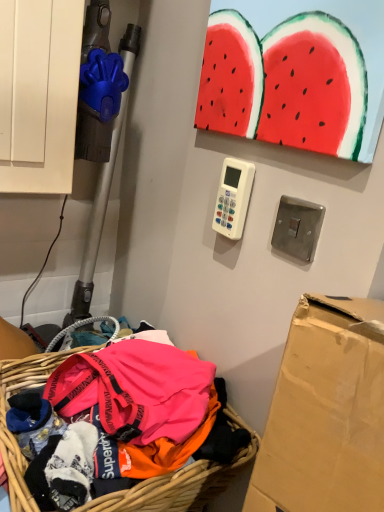
What do you see at coordinates (297, 228) in the screenshot? The width and height of the screenshot is (384, 512). I see `brushed metal light switch at upper right` at bounding box center [297, 228].

Where is `bright pink fabric at lower left`? This screenshot has width=384, height=512. bright pink fabric at lower left is located at coordinates (179, 486).

The height and width of the screenshot is (512, 384). I want to click on white plastic remote control at center, so click(233, 198).

In order to click on brushed metal light switch at upper right in this screenshot , I will do `click(297, 228)`.

Image resolution: width=384 pixels, height=512 pixels. I want to click on scale above the bright pink fabric at lower left (from the image's perspective), so click(x=233, y=198).

Relative to bright pink fabric at lower left, is white plastic remote control at center in front or behind?

white plastic remote control at center is positioned farther from the viewer than bright pink fabric at lower left.

From the image's perspective, relative to bright pink fabric at lower left, is white plastic remote control at center above or below?

white plastic remote control at center is above bright pink fabric at lower left.

Is bright pink fabric at lower left located within white plastic remote control at center?

No.

Does white plastic remote control at center have a greater width compared to brushed metal light switch at upper right?

Indeed, white plastic remote control at center has a greater width compared to brushed metal light switch at upper right.

Can you confirm if white plastic remote control at center is smaller than brushed metal light switch at upper right?

Incorrect, white plastic remote control at center is not smaller in size than brushed metal light switch at upper right.

From a real-world perspective, between white plastic remote control at center and brushed metal light switch at upper right, who is vertically lower?

brushed metal light switch at upper right.

Looking at the image, does brushed metal light switch at upper right seem bigger or smaller compared to white plastic remote control at center?

In the image, brushed metal light switch at upper right appears to be smaller than white plastic remote control at center.

Considering the relative positions of brushed metal light switch at upper right and white plastic remote control at center in the image provided, is brushed metal light switch at upper right to the right of white plastic remote control at center from the viewer's perspective?

Indeed, brushed metal light switch at upper right is positioned on the right side of white plastic remote control at center.

Looking at this image, in the image, is brushed metal light switch at upper right positioned in front of or behind white plastic remote control at center?

Visually, brushed metal light switch at upper right is located in front of white plastic remote control at center.

From a real-world perspective, relative to white plastic remote control at center, is brushed metal light switch at upper right vertically above or below?

brushed metal light switch at upper right is below white plastic remote control at center.

Is bright pink fabric at lower left positioned beyond the bounds of brushed metal light switch at upper right?

Indeed, bright pink fabric at lower left is completely outside brushed metal light switch at upper right.

From a real-world perspective, is bright pink fabric at lower left below brushed metal light switch at upper right?

Yes, from a real-world perspective, bright pink fabric at lower left is beneath brushed metal light switch at upper right.

Locate an element on the screen. This screenshot has width=384, height=512. basket directly beneath the brushed metal light switch at upper right (from a real-world perspective) is located at coordinates (179, 486).

Is bright pink fabric at lower left aimed at brushed metal light switch at upper right?

No, bright pink fabric at lower left is not facing towards brushed metal light switch at upper right.

From a real-world perspective, is bright pink fabric at lower left physically below white plastic remote control at center?

Yes, from a real-world perspective, bright pink fabric at lower left is below white plastic remote control at center.

Locate an element on the screen. The height and width of the screenshot is (512, 384). scale that is above the bright pink fabric at lower left (from a real-world perspective) is located at coordinates (233, 198).

Is bright pink fabric at lower left positioned with its back to white plastic remote control at center?

bright pink fabric at lower left is not turned away from white plastic remote control at center.

Who is bigger, bright pink fabric at lower left or white plastic remote control at center?

bright pink fabric at lower left is bigger.

Considering the relative sizes of brushed metal light switch at upper right and bright pink fabric at lower left in the image provided, is brushed metal light switch at upper right bigger than bright pink fabric at lower left?

No, brushed metal light switch at upper right is not bigger than bright pink fabric at lower left.

Looking at this image, is brushed metal light switch at upper right facing away from bright pink fabric at lower left?

No, brushed metal light switch at upper right is not facing the opposite direction of bright pink fabric at lower left.

Visually, is brushed metal light switch at upper right positioned to the left or to the right of bright pink fabric at lower left?

Based on their positions, brushed metal light switch at upper right is located to the right of bright pink fabric at lower left.

From the image's perspective, which one is positioned higher, brushed metal light switch at upper right or bright pink fabric at lower left?

brushed metal light switch at upper right is shown above in the image.

Where is `basket below the white plastic remote control at center (from the image's perspective)`? basket below the white plastic remote control at center (from the image's perspective) is located at coordinates (179, 486).

The width and height of the screenshot is (384, 512). Find the location of `scale behind the brushed metal light switch at upper right`. scale behind the brushed metal light switch at upper right is located at coordinates (233, 198).

When comparing their distances from bright pink fabric at lower left, does brushed metal light switch at upper right or white plastic remote control at center seem closer?

white plastic remote control at center is closer to bright pink fabric at lower left.

Which object lies nearer to the anchor point white plastic remote control at center, bright pink fabric at lower left or brushed metal light switch at upper right?

bright pink fabric at lower left is closer to white plastic remote control at center.

Based on their spatial positions, is brushed metal light switch at upper right or bright pink fabric at lower left closer to white plastic remote control at center?

bright pink fabric at lower left lies closer to white plastic remote control at center than the other object.

Considering their positions, is bright pink fabric at lower left positioned further to brushed metal light switch at upper right than white plastic remote control at center?

Among the two, bright pink fabric at lower left is located further to brushed metal light switch at upper right.

Considering their positions, is white plastic remote control at center positioned closer to bright pink fabric at lower left than brushed metal light switch at upper right?

The object closer to bright pink fabric at lower left is white plastic remote control at center.

Estimate the real-world distances between objects in this image. Which object is further from brushed metal light switch at upper right, white plastic remote control at center or bright pink fabric at lower left?

The object further to brushed metal light switch at upper right is bright pink fabric at lower left.

Identify the location of light switch between white plastic remote control at center and bright pink fabric at lower left in the vertical direction. (297, 228).